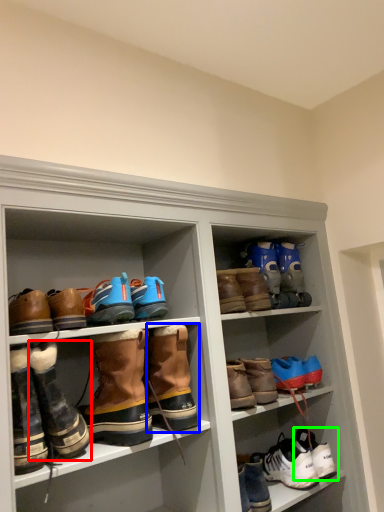
Question: Estimate the real-world distances between objects in this image. Which object is farther from footwear (highlighted by a red box), footwear (highlighted by a blue box) or footwear (highlighted by a green box)?

Choices:
 (A) footwear
 (B) footwear

Answer: (B)